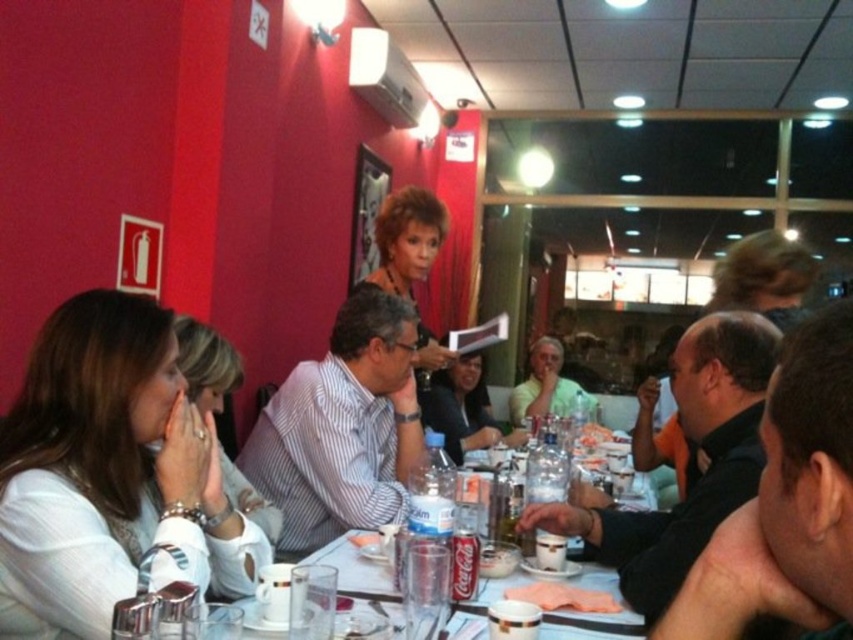
You are a photographer taking a group photo of the people at the table. You want to ensure that both the black shirt at center and the light green shirt at center are clearly visible in the photo. Which shirt should you focus on to ensure it is in sharp focus first?

The black shirt at center is thinner than the light green shirt at center, so you should focus on the light green shirt at center first because it has a larger surface area and will be easier to capture in sharp focus.

You are a server in a restaurant. You need to deliver a drink to the person wearing the white matte shirt at left and the light green shirt at center. The tray you are carrying can hold drinks for two people. However, the tray has a maximum weight capacity of 3 kilograms. Each drink weighs 0.5 kilograms. How many drinks can you safely carry on the tray for both customers?

The question mentions delivering drinks to two people, so you need to provide two drinks total. Each drink weighs 0.5 kilograms, so two drinks would weigh 1 kilogram total. Since the tray can hold up to 3 kilograms, you can safely carry two drinks for both customers.

You are a photographer taking a group photo of the people at the table. You notice the black glossy shirt at center and the light green shirt at center. Which shirt should you adjust to avoid overlapping in the photo, considering their sizes?

The black glossy shirt at center has a lesser width compared to light green shirt at center. Therefore, you should adjust the light green shirt at center since it is wider and more likely to cause overlap.